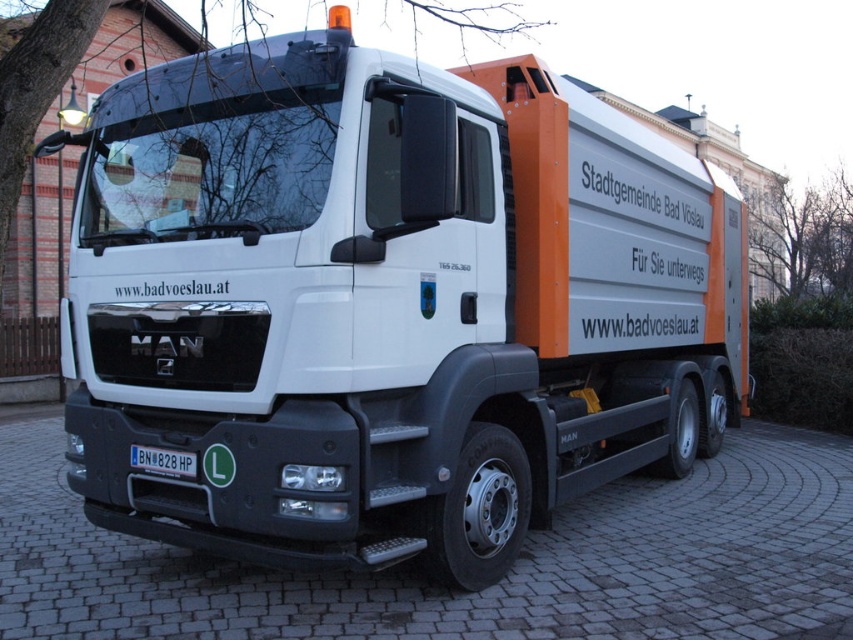
Is bare branches at upper left bigger than black plastic license plate at lower center?

Indeed, bare branches at upper left has a larger size compared to black plastic license plate at lower center.

I want to click on bare branches at upper left, so click(38, 237).

Where is `bare branches at upper left`? bare branches at upper left is located at coordinates (38, 237).

Who is taller, bare branches at upper left or bare branches at upper right?

With more height is bare branches at upper left.

Find the location of a particular element. bare branches at upper left is located at coordinates (38, 237).

Which is behind, point (4, 262) or point (840, 237)?

The point (840, 237) is more distant.

Where is `bare branches at upper left`? Image resolution: width=853 pixels, height=640 pixels. bare branches at upper left is located at coordinates coord(38,237).

Does point (808, 221) come behind point (132, 445)?

Yes.

Is point (766, 196) less distant than point (178, 460)?

No, it is not.

Is point (764, 228) positioned after point (164, 474)?

Yes.

You are a GUI agent. You are given a task and a screenshot of the screen. Output one action in this format:
    pyautogui.click(x=<x>, y=<y>)
    Task: Click on the bare branches at upper right
    Image resolution: width=853 pixels, height=640 pixels.
    Given the screenshot: What is the action you would take?
    pyautogui.click(x=804, y=237)